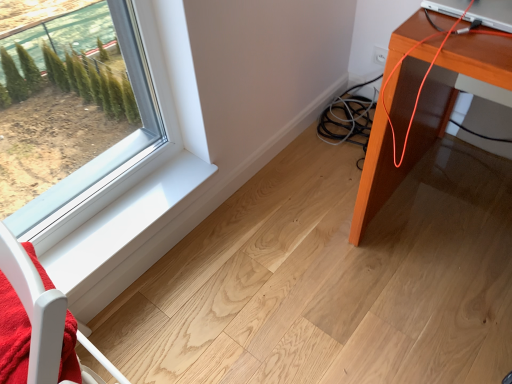
Question: From the image's perspective, would you say silver metallic laptop at upper right is shown under white smooth window sill at lower left?

Choices:
 (A) no
 (B) yes

Answer: (A)

Question: Does silver metallic laptop at upper right have a larger size compared to white smooth window sill at lower left?

Choices:
 (A) yes
 (B) no

Answer: (A)

Question: Can you confirm if silver metallic laptop at upper right is taller than white smooth window sill at lower left?

Choices:
 (A) no
 (B) yes

Answer: (B)

Question: Considering the relative sizes of silver metallic laptop at upper right and white smooth window sill at lower left in the image provided, is silver metallic laptop at upper right wider than white smooth window sill at lower left?

Choices:
 (A) yes
 (B) no

Answer: (A)

Question: Would you say silver metallic laptop at upper right contains white smooth window sill at lower left?

Choices:
 (A) no
 (B) yes

Answer: (A)

Question: Is point (167, 185) closer or farther from the camera than point (352, 228)?

Choices:
 (A) closer
 (B) farther

Answer: (A)

Question: Do you think white smooth window sill at lower left is within orange wood table at right, or outside of it?

Choices:
 (A) inside
 (B) outside

Answer: (B)

Question: From a real-world perspective, is white smooth window sill at lower left above or below orange wood table at right?

Choices:
 (A) below
 (B) above

Answer: (A)

Question: Is white smooth window sill at lower left taller or shorter than orange wood table at right?

Choices:
 (A) short
 (B) tall

Answer: (A)

Question: Is silver metallic laptop at upper right in front of or behind orange wood table at right in the image?

Choices:
 (A) front
 (B) behind

Answer: (B)

Question: From a real-world perspective, relative to orange wood table at right, is silver metallic laptop at upper right vertically above or below?

Choices:
 (A) above
 (B) below

Answer: (A)

Question: Is point (495, 8) positioned closer to the camera than point (401, 129)?

Choices:
 (A) closer
 (B) farther

Answer: (A)

Question: Based on their sizes in the image, would you say silver metallic laptop at upper right is bigger or smaller than orange wood table at right?

Choices:
 (A) big
 (B) small

Answer: (B)

Question: Is orange wood table at right wider or thinner than white smooth window sill at lower left?

Choices:
 (A) thin
 (B) wide

Answer: (B)

Question: From a real-world perspective, is orange wood table at right above or below white smooth window sill at lower left?

Choices:
 (A) above
 (B) below

Answer: (A)